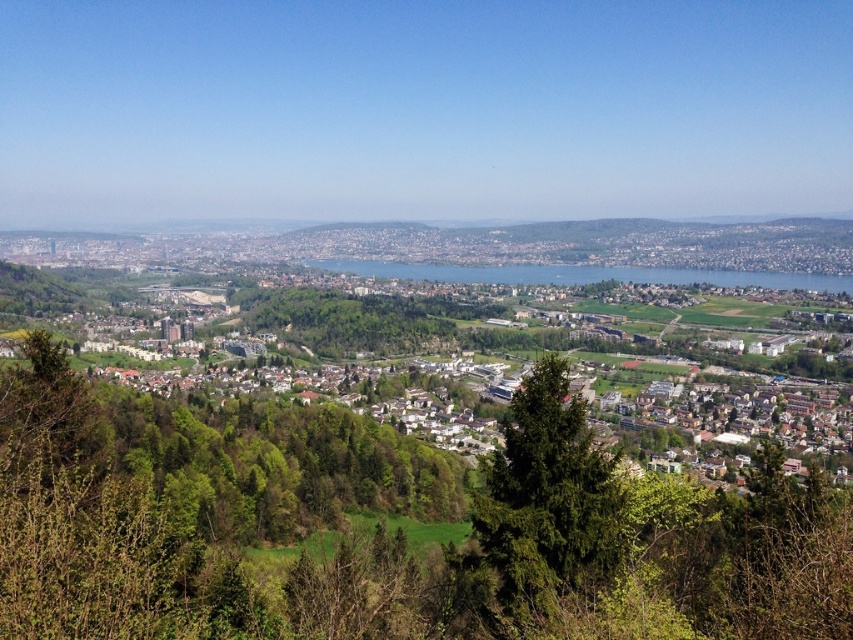
Which is behind, point (318, 493) or point (505, 484)?

The point (318, 493) is behind.

Is green grassy town at center further to camera compared to green leafy tree at center?

Yes, green grassy town at center is behind green leafy tree at center.

Where is `green grassy town at center`? green grassy town at center is located at coordinates (288, 465).

Between green leafy tree at center and blue water at center, which one appears on the right side from the viewer's perspective?

blue water at center is more to the right.

Who is lower down, green leafy tree at center or blue water at center?

green leafy tree at center is lower down.

Between point (547, 579) and point (352, 268), which one is positioned behind?

The point (352, 268) is behind.

Find the location of `green leafy tree at center`. green leafy tree at center is located at coordinates (543, 506).

Is green grassy town at center further to the viewer compared to blue water at center?

No.

Is green grassy town at center below blue water at center?

Indeed, green grassy town at center is positioned under blue water at center.

This screenshot has height=640, width=853. I want to click on green grassy town at center, so click(x=288, y=465).

Locate an element on the screen. The width and height of the screenshot is (853, 640). green grassy town at center is located at coordinates (288, 465).